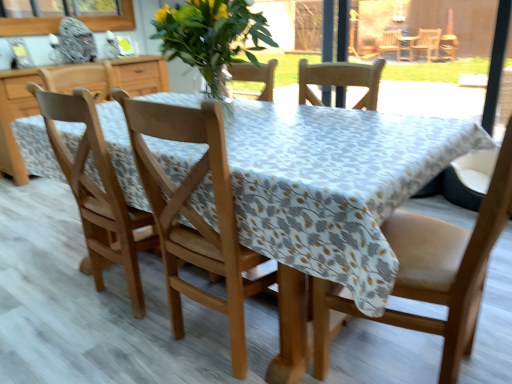
The image size is (512, 384). Describe the element at coordinates (432, 273) in the screenshot. I see `leather at right, marked as the third chair in a left-to-right arrangement` at that location.

What do you see at coordinates (98, 192) in the screenshot?
I see `wooden chair at left, the 1th chair in the left-to-right sequence` at bounding box center [98, 192].

Image resolution: width=512 pixels, height=384 pixels. Describe the element at coordinates (211, 233) in the screenshot. I see `wooden chair at center, the 2th chair viewed from the left` at that location.

Where is `leather at right, placed as the first chair when sorted from right to left`? The image size is (512, 384). leather at right, placed as the first chair when sorted from right to left is located at coordinates [x=432, y=273].

Considering the relative positions of wooden chair at left, the 1th chair in the left-to-right sequence, and clear glass window screen at upper left in the image provided, is wooden chair at left, the 1th chair in the left-to-right sequence, in front of clear glass window screen at upper left?

Yes, it is in front of clear glass window screen at upper left.

From the clear glass window screen at upper left, count 1st chairs forward and point to it. Please provide its 2D coordinates.

[(98, 192)]

Considering the sizes of objects wooden chair at left, the 1th chair in the left-to-right sequence, and clear glass window screen at upper left in the image provided, who is taller, wooden chair at left, the 1th chair in the left-to-right sequence, or clear glass window screen at upper left?

wooden chair at left, the 1th chair in the left-to-right sequence.

How much distance is there between wooden chair at left, which is the third chair from right to left, and wooden chair at center, marked as the 2th chair in a right-to-left arrangement?

The distance of wooden chair at left, which is the third chair from right to left, from wooden chair at center, marked as the 2th chair in a right-to-left arrangement, is 13.85 inches.

Can you tell me how much wooden chair at left, which is the third chair from right to left, and wooden chair at center, the 2th chair viewed from the left, differ in facing direction?

The angle between the facing direction of wooden chair at left, which is the third chair from right to left, and the facing direction of wooden chair at center, the 2th chair viewed from the left, is 0.00041 degrees.

Can you confirm if wooden chair at left, the 1th chair in the left-to-right sequence, is taller than wooden chair at center, marked as the 2th chair in a right-to-left arrangement?

Yes.

From a real-world perspective, is wooden chair at left, which is the third chair from right to left, physically above wooden chair at center, marked as the 2th chair in a right-to-left arrangement?

No, from a real-world perspective, wooden chair at left, which is the third chair from right to left, is not on top of wooden chair at center, marked as the 2th chair in a right-to-left arrangement.

Which of these two, clear glass window screen at upper left or wooden chair at left, the 1th chair in the left-to-right sequence, is thinner?

clear glass window screen at upper left.

Who is more distant, clear glass window screen at upper left or wooden chair at left, the 1th chair in the left-to-right sequence?

clear glass window screen at upper left is behind.

From the image's perspective, is clear glass window screen at upper left positioned above or below wooden chair at left, which is the third chair from right to left?

Based on their image positions, clear glass window screen at upper left is located above wooden chair at left, which is the third chair from right to left.

Is clear glass window screen at upper left to the right of wooden chair at left, which is the third chair from right to left, from the viewer's perspective?

In fact, clear glass window screen at upper left is to the left of wooden chair at left, which is the third chair from right to left.

Which is behind, leather at right, placed as the first chair when sorted from right to left, or wooden chair at left, which is the third chair from right to left?

wooden chair at left, which is the third chair from right to left, is behind.

Consider the image. Based on their positions, is leather at right, placed as the first chair when sorted from right to left, located to the left or right of wooden chair at left, which is the third chair from right to left?

From the image, it's evident that leather at right, placed as the first chair when sorted from right to left, is to the right of wooden chair at left, which is the third chair from right to left.

Does point (473, 326) come in front of point (94, 272)?

Yes, it is in front of point (94, 272).

In terms of width, does leather at right, marked as the third chair in a left-to-right arrangement, look wider or thinner when compared to wooden chair at left, which is the third chair from right to left?

Clearly, leather at right, marked as the third chair in a left-to-right arrangement, has more width compared to wooden chair at left, which is the third chair from right to left.

From a real-world perspective, is wooden chair at center, marked as the 2th chair in a right-to-left arrangement, under clear glass window screen at upper left?

Yes, from a real-world perspective, wooden chair at center, marked as the 2th chair in a right-to-left arrangement, is beneath clear glass window screen at upper left.

Considering the relative sizes of wooden chair at center, the 2th chair viewed from the left, and clear glass window screen at upper left in the image provided, is wooden chair at center, the 2th chair viewed from the left, smaller than clear glass window screen at upper left?

No.

This screenshot has height=384, width=512. Find the location of `chair that is the 2nd object to the right of the clear glass window screen at upper left, starting at the anchor`. chair that is the 2nd object to the right of the clear glass window screen at upper left, starting at the anchor is located at coordinates (x=211, y=233).

Which is less distant, (286,320) or (34,18)?

Point (286,320).

Is wooden chair at center, the 2th chair viewed from the left, a part of leather at right, marked as the third chair in a left-to-right arrangement?

No, wooden chair at center, the 2th chair viewed from the left, is not a part of leather at right, marked as the third chair in a left-to-right arrangement.

From a real-world perspective, which object stands above the other?

In real-world perspective, wooden chair at center, marked as the 2th chair in a right-to-left arrangement, is above.

Considering the sizes of leather at right, placed as the first chair when sorted from right to left, and wooden chair at center, marked as the 2th chair in a right-to-left arrangement, in the image, is leather at right, placed as the first chair when sorted from right to left, bigger or smaller than wooden chair at center, marked as the 2th chair in a right-to-left arrangement,?

Clearly, leather at right, placed as the first chair when sorted from right to left, is larger in size than wooden chair at center, marked as the 2th chair in a right-to-left arrangement.

Which of these two, leather at right, marked as the third chair in a left-to-right arrangement, or wooden chair at center, marked as the 2th chair in a right-to-left arrangement, stands shorter?

Standing shorter between the two is leather at right, marked as the third chair in a left-to-right arrangement.

Between leather at right, marked as the third chair in a left-to-right arrangement, and clear glass window screen at upper left, which one has larger width?

With larger width is leather at right, marked as the third chair in a left-to-right arrangement.

Who is shorter, leather at right, placed as the first chair when sorted from right to left, or clear glass window screen at upper left?

With less height is clear glass window screen at upper left.

From the image's perspective, is leather at right, placed as the first chair when sorted from right to left, located beneath clear glass window screen at upper left?

Correct, leather at right, placed as the first chair when sorted from right to left, appears lower than clear glass window screen at upper left in the image.

Which point is more forward, (446,358) or (30,31)?

Positioned in front is point (446,358).

At what (x,y) coordinates should I click in order to perform the action: click on the 1st chair in front when counting from the clear glass window screen at upper left. Please return your answer as a coordinate pair (x, y). Looking at the image, I should click on (98, 192).

Locate an element on the screen. The height and width of the screenshot is (384, 512). chair on the left of the wooden chair at center, the 2th chair viewed from the left is located at coordinates (98, 192).

Which object lies nearer to the anchor point wooden chair at center, marked as the 2th chair in a right-to-left arrangement, clear glass window screen at upper left or wooden chair at left, which is the third chair from right to left?

The object closer to wooden chair at center, marked as the 2th chair in a right-to-left arrangement, is wooden chair at left, which is the third chair from right to left.

From the image, which object appears to be nearer to clear glass window screen at upper left, wooden chair at left, which is the third chair from right to left, or leather at right, placed as the first chair when sorted from right to left?

The object closer to clear glass window screen at upper left is wooden chair at left, which is the third chair from right to left.

Looking at the image, which one is located further to leather at right, marked as the third chair in a left-to-right arrangement, clear glass window screen at upper left or wooden chair at center, marked as the 2th chair in a right-to-left arrangement?

clear glass window screen at upper left is positioned further to the anchor leather at right, marked as the third chair in a left-to-right arrangement.

Considering their positions, is wooden chair at center, marked as the 2th chair in a right-to-left arrangement, positioned further to leather at right, placed as the first chair when sorted from right to left, than clear glass window screen at upper left?

clear glass window screen at upper left.

Which object lies nearer to the anchor point leather at right, marked as the third chair in a left-to-right arrangement, wooden chair at center, marked as the 2th chair in a right-to-left arrangement, or wooden chair at left, the 1th chair in the left-to-right sequence?

Based on the image, wooden chair at center, marked as the 2th chair in a right-to-left arrangement, appears to be nearer to leather at right, marked as the third chair in a left-to-right arrangement.

Based on their spatial positions, is clear glass window screen at upper left or wooden chair at center, the 2th chair viewed from the left, further from wooden chair at left, the 1th chair in the left-to-right sequence?

Among the two, clear glass window screen at upper left is located further to wooden chair at left, the 1th chair in the left-to-right sequence.

Looking at the image, which one is located further to leather at right, placed as the first chair when sorted from right to left, wooden chair at left, which is the third chair from right to left, or wooden chair at center, the 2th chair viewed from the left?

wooden chair at left, which is the third chair from right to left.

Which object lies further to the anchor point clear glass window screen at upper left, wooden chair at center, marked as the 2th chair in a right-to-left arrangement, or wooden chair at left, the 1th chair in the left-to-right sequence?

wooden chair at center, marked as the 2th chair in a right-to-left arrangement, is further to clear glass window screen at upper left.

The width and height of the screenshot is (512, 384). In order to click on chair located between wooden chair at left, which is the third chair from right to left, and leather at right, placed as the first chair when sorted from right to left, in the left-right direction in this screenshot , I will do `click(211, 233)`.

This screenshot has width=512, height=384. What are the coordinates of `chair between wooden chair at center, marked as the 2th chair in a right-to-left arrangement, and clear glass window screen at upper left in the front-back direction` in the screenshot? It's located at (98, 192).